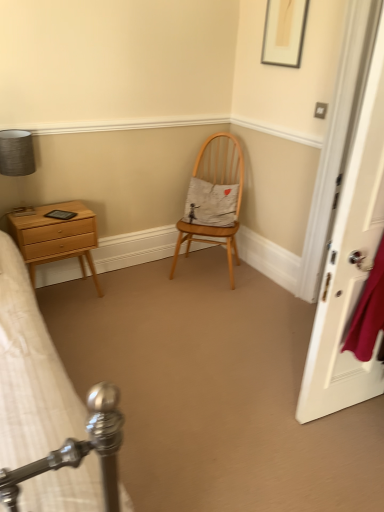
The height and width of the screenshot is (512, 384). What are the coordinates of `light brown wood nightstand at left` in the screenshot? It's located at (56, 237).

Image resolution: width=384 pixels, height=512 pixels. What do you see at coordinates (284, 32) in the screenshot?
I see `matte gold picture frame at upper center` at bounding box center [284, 32].

What is the approximate width of matte gold picture frame at upper center?

1.08 inches.

Describe the element at coordinates (350, 262) in the screenshot. I see `white wooden door at right` at that location.

You are a GUI agent. You are given a task and a screenshot of the screen. Output one action in this format:
    pyautogui.click(x=<x>, y=<y>)
    Task: Click on the light brown wood nightstand at left
    This screenshot has width=384, height=512.
    Given the screenshot: What is the action you would take?
    (56, 237)

Considering the relative positions of matte gold picture frame at upper center and matte gray lampshade at upper left in the image provided, is matte gold picture frame at upper center to the left of matte gray lampshade at upper left from the viewer's perspective?

No.

Are matte gold picture frame at upper center and matte gray lampshade at upper left making contact?

There is a gap between matte gold picture frame at upper center and matte gray lampshade at upper left.

Identify the location of bedside lamp lying below the matte gold picture frame at upper center (from the image's perspective). This screenshot has height=512, width=384. (16, 153).

From their relative heights in the image, would you say light wood chair at center is taller or shorter than matte gray lampshade at upper left?

Clearly, light wood chair at center is taller compared to matte gray lampshade at upper left.

Does light wood chair at center come in front of matte gray lampshade at upper left?

That is False.

Based on the photo, would you say light wood chair at center is a long distance from matte gray lampshade at upper left?

Absolutely, light wood chair at center is distant from matte gray lampshade at upper left.

In the scene shown: From the image's perspective, does white wooden door at right appear higher than matte gray lampshade at upper left?

No, from the image's perspective, white wooden door at right is not on top of matte gray lampshade at upper left.

Is white wooden door at right positioned far away from matte gray lampshade at upper left?

Absolutely, white wooden door at right is distant from matte gray lampshade at upper left.

Is white wooden door at right completely or partially outside of matte gray lampshade at upper left?

That's correct, white wooden door at right is outside of matte gray lampshade at upper left.

Considering the relative positions of white wooden door at right and matte gray lampshade at upper left in the image provided, is white wooden door at right to the right of matte gray lampshade at upper left from the viewer's perspective?

Yes.

Is light wood chair at center far away from white wooden door at right?

Yes, light wood chair at center is far from white wooden door at right.

Based on the photo, visually, is light wood chair at center positioned to the left or to the right of white wooden door at right?

Based on their positions, light wood chair at center is located to the left of white wooden door at right.

Is light wood chair at center aimed at white wooden door at right?

No, light wood chair at center is not facing towards white wooden door at right.

How much distance is there between white wooden door at right and light brown wood nightstand at left?

→ white wooden door at right is 1.65 meters away from light brown wood nightstand at left.

Considering the positions of points (377, 207) and (76, 201), is point (377, 207) closer to camera compared to point (76, 201)?

Yes.

Can you confirm if white wooden door at right is taller than light brown wood nightstand at left?

Correct, white wooden door at right is much taller as light brown wood nightstand at left.

How different are the orientations of white wooden door at right and light brown wood nightstand at left in degrees?

They differ by 170 degrees in their facing directions.

Considering the relative sizes of white wooden door at right and matte gold picture frame at upper center in the image provided, is white wooden door at right bigger than matte gold picture frame at upper center?

Yes.

Measure the distance between white wooden door at right and matte gold picture frame at upper center.

white wooden door at right is 39.31 inches away from matte gold picture frame at upper center.

Can you confirm if white wooden door at right is wider than matte gold picture frame at upper center?

Indeed, white wooden door at right has a greater width compared to matte gold picture frame at upper center.

Is white wooden door at right in contact with matte gold picture frame at upper center?

white wooden door at right and matte gold picture frame at upper center are not in contact.

Locate an element on the screen. Image resolution: width=384 pixels, height=512 pixels. bedside lamp that is on the left side of light wood chair at center is located at coordinates (16, 153).

Is matte gray lampshade at upper left at the left side of light wood chair at center?

Indeed, matte gray lampshade at upper left is positioned on the left side of light wood chair at center.

Considering the relative sizes of matte gray lampshade at upper left and light wood chair at center in the image provided, is matte gray lampshade at upper left smaller than light wood chair at center?

Indeed, matte gray lampshade at upper left has a smaller size compared to light wood chair at center.

How different are the orientations of matte gray lampshade at upper left and light wood chair at center in degrees?

The facing directions of matte gray lampshade at upper left and light wood chair at center are 42.7 degrees apart.

Locate an element on the screen. The width and height of the screenshot is (384, 512). picture frame that appears above the matte gray lampshade at upper left (from the image's perspective) is located at coordinates (284, 32).

Image resolution: width=384 pixels, height=512 pixels. Find the location of `chair on the right of matte gray lampshade at upper left`. chair on the right of matte gray lampshade at upper left is located at coordinates (214, 198).

Considering their positions, is white wooden door at right positioned further to matte gray lampshade at upper left than matte gold picture frame at upper center?

Based on the image, white wooden door at right appears to be further to matte gray lampshade at upper left.

Based on their spatial positions, is light brown wood nightstand at left or matte gold picture frame at upper center closer to light wood chair at center?

The object closer to light wood chair at center is light brown wood nightstand at left.

Estimate the real-world distances between objects in this image. Which object is further from light wood chair at center, light brown wood nightstand at left or matte gray lampshade at upper left?

matte gray lampshade at upper left lies further to light wood chair at center than the other object.

Based on their spatial positions, is matte gray lampshade at upper left or light brown wood nightstand at left further from white wooden door at right?

Among the two, matte gray lampshade at upper left is located further to white wooden door at right.

When comparing their distances from matte gray lampshade at upper left, does light brown wood nightstand at left or light wood chair at center seem closer?

Among the two, light brown wood nightstand at left is located nearer to matte gray lampshade at upper left.

Considering their positions, is light brown wood nightstand at left positioned closer to matte gray lampshade at upper left than matte gold picture frame at upper center?

Among the two, light brown wood nightstand at left is located nearer to matte gray lampshade at upper left.

Based on their spatial positions, is white wooden door at right or light brown wood nightstand at left further from light wood chair at center?

The object further to light wood chair at center is white wooden door at right.

From the image, which object appears to be nearer to light wood chair at center, white wooden door at right or matte gray lampshade at upper left?

white wooden door at right.

The height and width of the screenshot is (512, 384). I want to click on chair situated between light brown wood nightstand at left and matte gold picture frame at upper center from left to right, so click(214, 198).

The height and width of the screenshot is (512, 384). I want to click on picture frame between matte gray lampshade at upper left and white wooden door at right, so click(x=284, y=32).

The height and width of the screenshot is (512, 384). I want to click on nightstand between matte gray lampshade at upper left and light wood chair at center, so pyautogui.click(x=56, y=237).

Identify the location of picture frame located between light brown wood nightstand at left and white wooden door at right in the left-right direction. (284, 32).